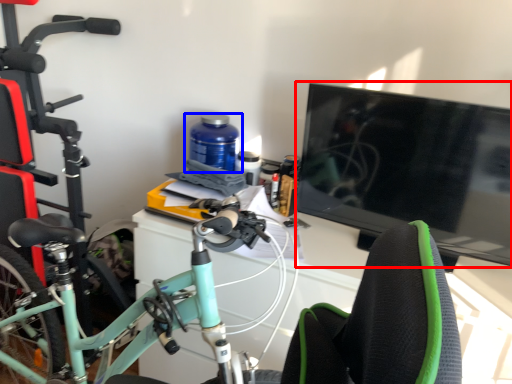
Question: Which object is closer to the camera taking this photo, television (highlighted by a red box) or bottle (highlighted by a blue box)?

Choices:
 (A) television
 (B) bottle

Answer: (A)